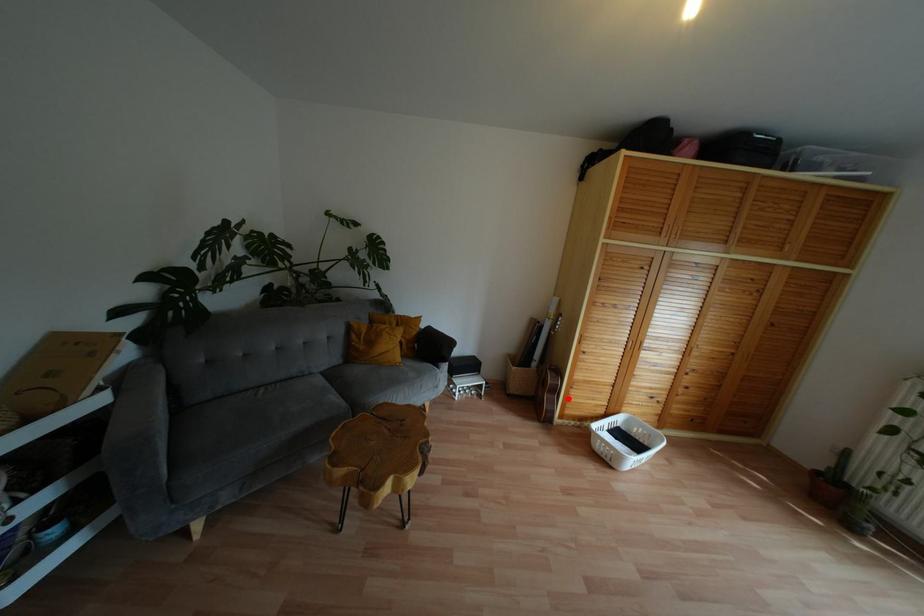
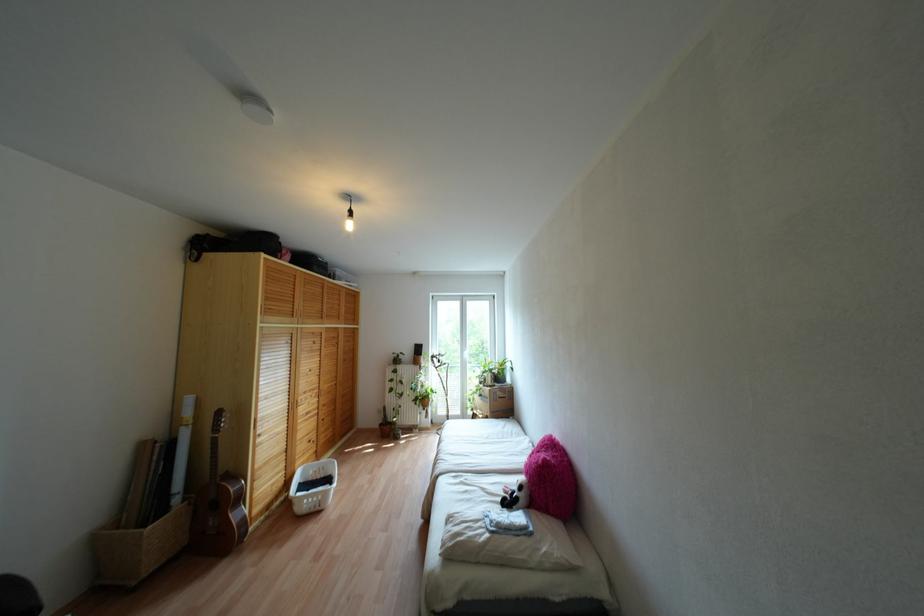
Question: I am providing you with two images of the same scene from different viewpoints. Given a red point in image1, look at the same physical point in image2. Is it:

Choices:
 (A) Closer to the viewpoint
 (B) Farther from the viewpoint

Answer: (A)